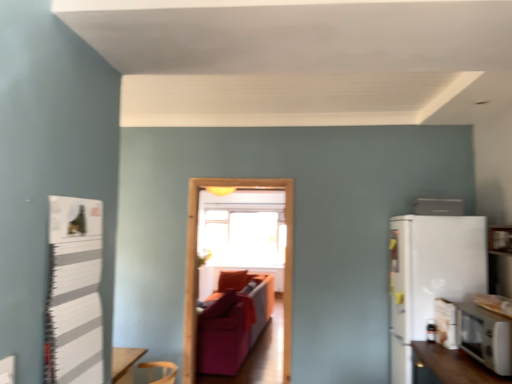
Locate an element on the screen. velvet red couch at center is located at coordinates (233, 326).

The width and height of the screenshot is (512, 384). I want to click on transparent glass door at center, so click(194, 263).

The height and width of the screenshot is (384, 512). What do you see at coordinates (74, 293) in the screenshot?
I see `white striped bulletin board at left` at bounding box center [74, 293].

Where is `velvet red couch at center`? The width and height of the screenshot is (512, 384). velvet red couch at center is located at coordinates (233, 326).

From the image's perspective, is white glossy refrigerator at upper right, acting as the 1th appliance starting from the back, on velvet red couch at center?

Correct, white glossy refrigerator at upper right, acting as the 1th appliance starting from the back, appears higher than velvet red couch at center in the image.

Can you confirm if white glossy refrigerator at upper right, acting as the 1th appliance starting from the back, is taller than velvet red couch at center?

In fact, white glossy refrigerator at upper right, acting as the 1th appliance starting from the back, may be shorter than velvet red couch at center.

Is white glossy refrigerator at upper right, placed as the second appliance when sorted from front to back, at the left side of velvet red couch at center?

In fact, white glossy refrigerator at upper right, placed as the second appliance when sorted from front to back, is to the right of velvet red couch at center.

Which of these two, white glossy refrigerator at upper right, placed as the second appliance when sorted from front to back, or velvet red couch at center, is wider?

velvet red couch at center.

Which object is thinner, white glossy microwave at lower right, acting as the 2th appliance starting from the back, or white striped bulletin board at left?

With smaller width is white striped bulletin board at left.

Is white glossy microwave at lower right, acting as the 2th appliance starting from the back, facing towards white striped bulletin board at left?

No, white glossy microwave at lower right, acting as the 2th appliance starting from the back, is not turned towards white striped bulletin board at left.

Would you say white glossy microwave at lower right, the 2th appliance from the top, contains white striped bulletin board at left?

That's incorrect, white striped bulletin board at left is not inside white glossy microwave at lower right, the 2th appliance from the top.

Can you confirm if white glossy microwave at lower right, acting as the 2th appliance starting from the back, is shorter than white striped bulletin board at left?

Correct, white glossy microwave at lower right, acting as the 2th appliance starting from the back, is not as tall as white striped bulletin board at left.

Does point (406, 329) lie behind point (434, 202)?

Yes, point (406, 329) is behind point (434, 202).

Is white matte refrigerator at right wider or thinner than white glossy refrigerator at upper right, acting as the 1th appliance starting from the back?

In the image, white matte refrigerator at right appears to be wider than white glossy refrigerator at upper right, acting as the 1th appliance starting from the back.

Are white matte refrigerator at right and white glossy refrigerator at upper right, acting as the 1th appliance starting from the back, far apart?

white matte refrigerator at right is near white glossy refrigerator at upper right, acting as the 1th appliance starting from the back, not far away.

Is white matte refrigerator at right oriented towards white glossy refrigerator at upper right, placed as the second appliance when sorted from front to back?

No, white matte refrigerator at right does not turn towards white glossy refrigerator at upper right, placed as the second appliance when sorted from front to back.

How different are the orientations of transparent glass door at center and transparent glass window screen at center in degrees?

The facing directions of transparent glass door at center and transparent glass window screen at center are 0.459 degrees apart.

Considering the positions of objects transparent glass door at center and transparent glass window screen at center in the image provided, who is more to the left, transparent glass door at center or transparent glass window screen at center?

transparent glass window screen at center.

From a real-world perspective, is transparent glass door at center located higher than transparent glass window screen at center?

No, from a real-world perspective, transparent glass door at center is not on top of transparent glass window screen at center.

Is transparent glass door at center in front of or behind transparent glass window screen at center in the image?

transparent glass door at center is positioned closer to the viewer than transparent glass window screen at center.

Considering the relative sizes of white matte refrigerator at right and transparent glass door at center in the image provided, is white matte refrigerator at right smaller than transparent glass door at center?

Incorrect, white matte refrigerator at right is not smaller in size than transparent glass door at center.

Can you confirm if white matte refrigerator at right is taller than transparent glass door at center?

No.

Looking at this image, are white matte refrigerator at right and transparent glass door at center making contact?

No, white matte refrigerator at right is not touching transparent glass door at center.

In the image, is white matte refrigerator at right on the left side or the right side of transparent glass door at center?

white matte refrigerator at right is positioned on transparent glass door at center's right side.

Considering the sizes of white glossy refrigerator at upper right, placed as the second appliance when sorted from front to back, and transparent glass door at center in the image, is white glossy refrigerator at upper right, placed as the second appliance when sorted from front to back, taller or shorter than transparent glass door at center?

white glossy refrigerator at upper right, placed as the second appliance when sorted from front to back, is shorter than transparent glass door at center.

Is white glossy refrigerator at upper right, acting as the 1th appliance starting from the back, beside transparent glass door at center?

No, white glossy refrigerator at upper right, acting as the 1th appliance starting from the back, is not making contact with transparent glass door at center.

Based on the photo, considering the relative sizes of white glossy refrigerator at upper right, the 2th appliance ordered from the bottom, and transparent glass door at center in the image provided, is white glossy refrigerator at upper right, the 2th appliance ordered from the bottom, thinner than transparent glass door at center?

No, white glossy refrigerator at upper right, the 2th appliance ordered from the bottom, is not thinner than transparent glass door at center.

How distant is transparent glass window screen at center from transparent glass door at center?

They are 2.68 meters apart.

What's the angular difference between transparent glass window screen at center and transparent glass door at center's facing directions?

There is a 0.459-degree angle between the facing directions of transparent glass window screen at center and transparent glass door at center.

Which is closer to the camera, (238,262) or (291,192)?

Point (238,262) is positioned farther from the camera compared to point (291,192).

Could you tell me if transparent glass window screen at center is turned towards transparent glass door at center?

Yes, transparent glass window screen at center faces towards transparent glass door at center.

Locate an element on the screen. The width and height of the screenshot is (512, 384). couch that appears behind the white glossy refrigerator at upper right, the 2th appliance ordered from the bottom is located at coordinates (233, 326).

Identify the location of bulletin board in front of the white glossy microwave at lower right, the 1th appliance in the front-to-back sequence. pyautogui.click(x=74, y=293).

Which object lies nearer to the anchor point white matte refrigerator at right, white glossy refrigerator at upper right, acting as the 1th appliance starting from the back, or velvet red couch at center?

The object closer to white matte refrigerator at right is white glossy refrigerator at upper right, acting as the 1th appliance starting from the back.

Based on their spatial positions, is white matte refrigerator at right or transparent glass window screen at center closer to white glossy refrigerator at upper right, the first appliance positioned from the top?

white matte refrigerator at right.

Which object lies further to the anchor point white glossy microwave at lower right, the first appliance in the bottom-to-top sequence, velvet red couch at center or transparent glass window screen at center?

transparent glass window screen at center.

From the image, which object appears to be nearer to transparent glass door at center, velvet red couch at center or white glossy refrigerator at upper right, the 2th appliance ordered from the bottom?

The object closer to transparent glass door at center is velvet red couch at center.

From the image, which object appears to be nearer to white glossy microwave at lower right, the 1th appliance in the front-to-back sequence, transparent glass window screen at center or white matte refrigerator at right?

Among the two, white matte refrigerator at right is located nearer to white glossy microwave at lower right, the 1th appliance in the front-to-back sequence.

Which object lies nearer to the anchor point transparent glass window screen at center, transparent glass door at center or white matte refrigerator at right?

The object closer to transparent glass window screen at center is transparent glass door at center.

Considering their positions, is white glossy refrigerator at upper right, the 2th appliance ordered from the bottom, positioned closer to velvet red couch at center than white striped bulletin board at left?

white glossy refrigerator at upper right, the 2th appliance ordered from the bottom.

From the image, which object appears to be nearer to white glossy microwave at lower right, acting as the 2th appliance starting from the back, velvet red couch at center or white striped bulletin board at left?

white striped bulletin board at left lies closer to white glossy microwave at lower right, acting as the 2th appliance starting from the back, than the other object.

At what (x,y) coordinates should I click in order to perform the action: click on glass door between white glossy microwave at lower right, the 2th appliance from the top, and velvet red couch at center from front to back. Please return your answer as a coordinate pair (x, y). This screenshot has width=512, height=384. Looking at the image, I should click on (194, 263).

In order to click on appliance between white glossy refrigerator at upper right, the 2th appliance ordered from the bottom, and white matte refrigerator at right vertically in this screenshot , I will do `click(484, 337)`.

The height and width of the screenshot is (384, 512). In order to click on refrigerator located between transparent glass door at center and white glossy microwave at lower right, the 1th appliance in the front-to-back sequence, in the left-right direction in this screenshot , I will do `click(430, 275)`.

What are the coordinates of `refrigerator between white striped bulletin board at left and transparent glass window screen at center from front to back` in the screenshot? It's located at (430, 275).